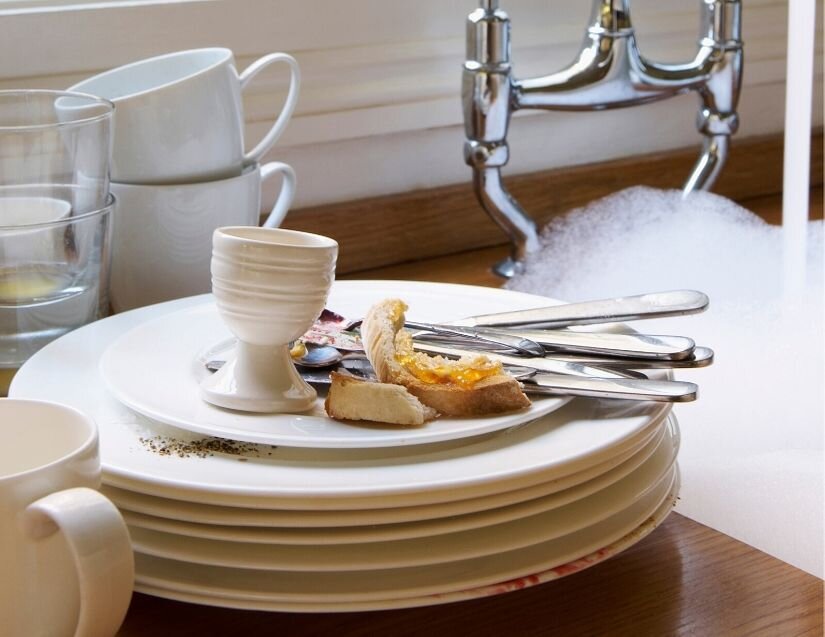
Locate an element on the screen. The image size is (825, 637). cup is located at coordinates (55, 169), (55, 260), (172, 224), (177, 138), (11, 506).